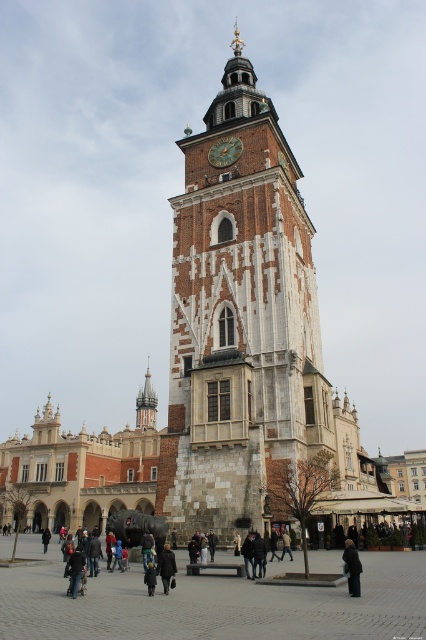
Is gold textured clock at center to the left of dark wool coat at center from the viewer's perspective?

Incorrect, gold textured clock at center is not on the left side of dark wool coat at center.

Can you confirm if gold textured clock at center is positioned to the right of dark wool coat at center?

Correct, you'll find gold textured clock at center to the right of dark wool coat at center.

You are a GUI agent. You are given a task and a screenshot of the screen. Output one action in this format:
    pyautogui.click(x=<x>, y=<y>)
    Task: Click on the gold textured clock at center
    This screenshot has width=426, height=640.
    Given the screenshot: What is the action you would take?
    pyautogui.click(x=224, y=150)

Which is behind, point (232, 253) or point (287, 541)?

The point (232, 253) is behind.

Is point (203, 392) positioned before point (284, 554)?

No, it is not.

This screenshot has width=426, height=640. I want to click on white stone clock tower at center, so click(x=239, y=321).

Does dark gray wool coat at center have a smaller size compared to dark brown leather coat at lower left?

Yes, dark gray wool coat at center is smaller than dark brown leather coat at lower left.

Does dark gray wool coat at center have a greater height compared to dark brown leather coat at lower left?

In fact, dark gray wool coat at center may be shorter than dark brown leather coat at lower left.

Between point (348, 547) and point (43, 550), which one is positioned in front?

Point (348, 547) is in front.

At what (x,y) coordinates should I click in order to perform the action: click on dark gray wool coat at center. Please return your answer as a coordinate pair (x, y). This screenshot has width=426, height=640. Looking at the image, I should click on (353, 566).